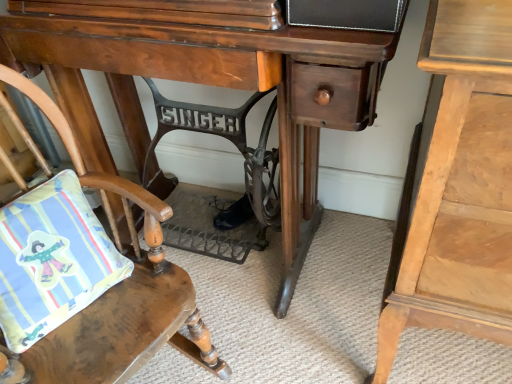
Question: Can you confirm if wooden desk at center is taller than light wood nightstand at right?

Choices:
 (A) no
 (B) yes

Answer: (A)

Question: From a real-world perspective, is wooden desk at center located higher than light wood nightstand at right?

Choices:
 (A) yes
 (B) no

Answer: (B)

Question: Does wooden desk at center have a lesser width compared to light wood nightstand at right?

Choices:
 (A) no
 (B) yes

Answer: (B)

Question: Is the position of wooden desk at center more distant than that of light wood nightstand at right?

Choices:
 (A) no
 (B) yes

Answer: (B)

Question: Is the depth of wooden desk at center less than that of light wood nightstand at right?

Choices:
 (A) yes
 (B) no

Answer: (B)

Question: Is light wood nightstand at right to the left or to the right of matte cotton pillow at lower left in the image?

Choices:
 (A) right
 (B) left

Answer: (A)

Question: From the image's perspective, is light wood nightstand at right positioned above or below matte cotton pillow at lower left?

Choices:
 (A) below
 (B) above

Answer: (B)

Question: Looking at their shapes, would you say light wood nightstand at right is wider or thinner than matte cotton pillow at lower left?

Choices:
 (A) wide
 (B) thin

Answer: (A)

Question: From their relative heights in the image, would you say light wood nightstand at right is taller or shorter than matte cotton pillow at lower left?

Choices:
 (A) tall
 (B) short

Answer: (A)

Question: Based on their positions, is matte cotton pillow at lower left located to the left or right of wooden cushioned chair at lower left?

Choices:
 (A) left
 (B) right

Answer: (A)

Question: Is matte cotton pillow at lower left inside the boundaries of wooden cushioned chair at lower left, or outside?

Choices:
 (A) outside
 (B) inside

Answer: (B)

Question: In terms of height, does matte cotton pillow at lower left look taller or shorter compared to wooden cushioned chair at lower left?

Choices:
 (A) short
 (B) tall

Answer: (A)

Question: Is point (4, 225) closer or farther from the camera than point (178, 279)?

Choices:
 (A) closer
 (B) farther

Answer: (A)

Question: From a real-world perspective, is wooden cushioned chair at lower left physically located above or below matte cotton pillow at lower left?

Choices:
 (A) below
 (B) above

Answer: (A)

Question: Visually, is wooden cushioned chair at lower left positioned to the left or to the right of matte cotton pillow at lower left?

Choices:
 (A) left
 (B) right

Answer: (B)